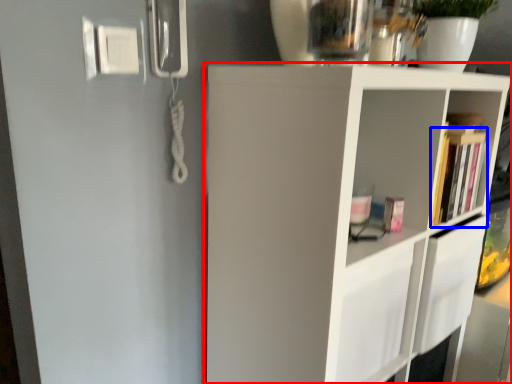
Question: Which object is further to the camera taking this photo, shelf (highlighted by a red box) or book (highlighted by a blue box)?

Choices:
 (A) shelf
 (B) book

Answer: (B)